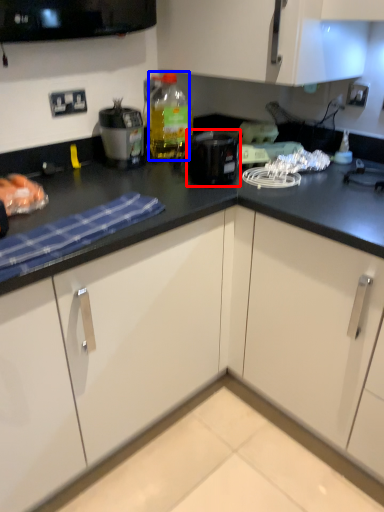
Question: Which object is closer to the camera taking this photo, kitchen appliance (highlighted by a red box) or bottle (highlighted by a blue box)?

Choices:
 (A) kitchen appliance
 (B) bottle

Answer: (A)